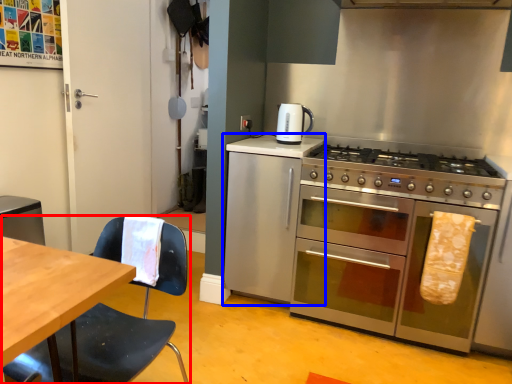
Question: Which point is closer to the camera, chair (highlighted by a red box) or cabinetry (highlighted by a blue box)?

Choices:
 (A) chair
 (B) cabinetry

Answer: (A)